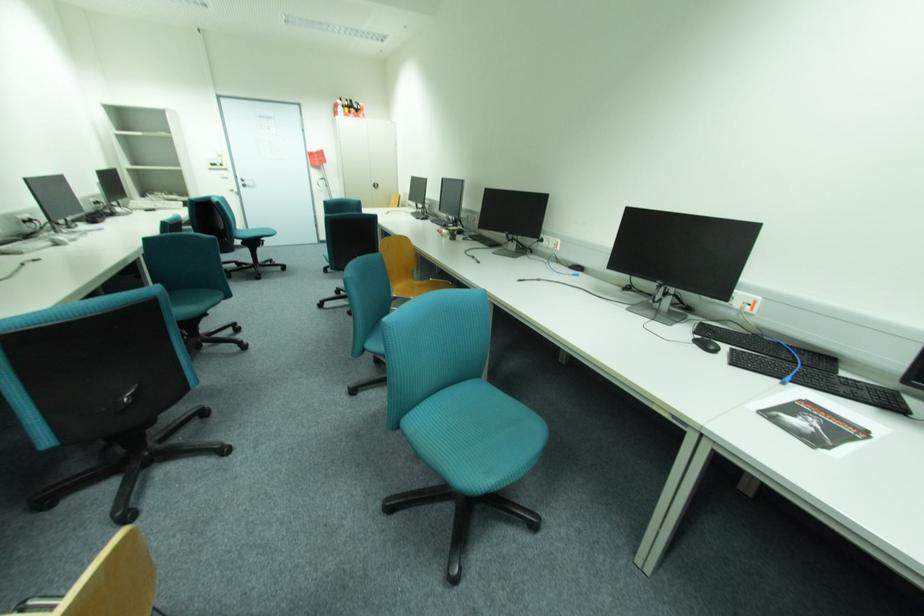
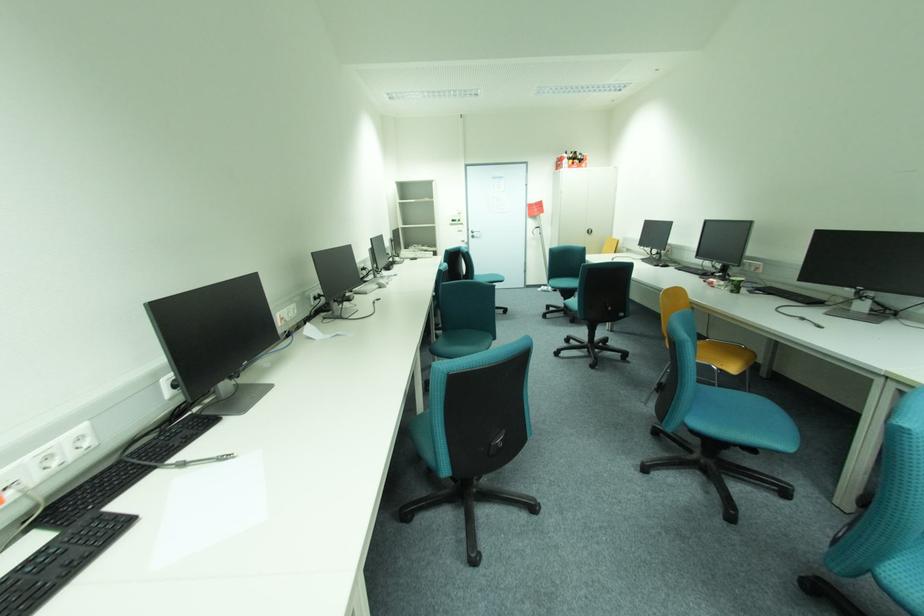
Where in the second image is the point corresponding to (x=248, y=183) from the first image?

(477, 235)